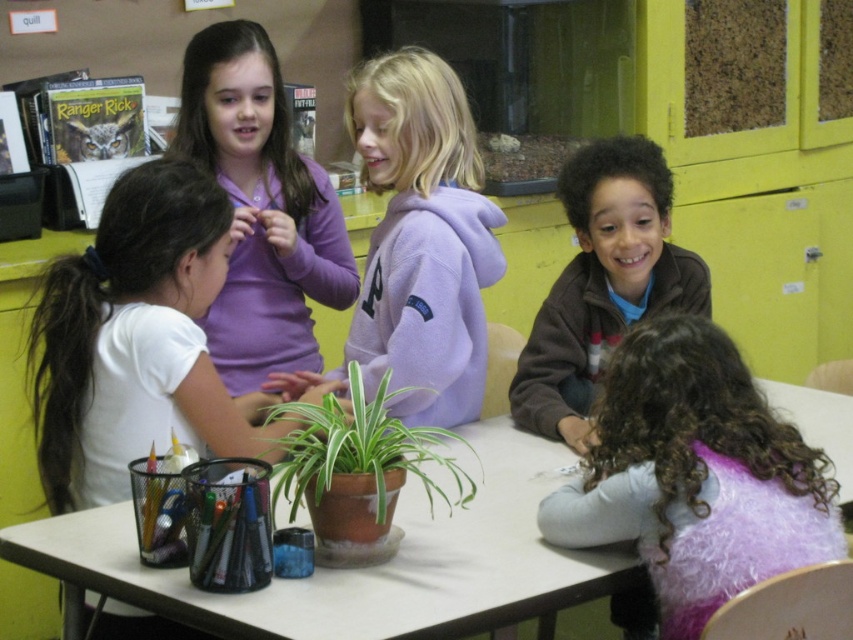
Where is the white plastic table at center located in the image?

The white plastic table at center is located at point (364,568).